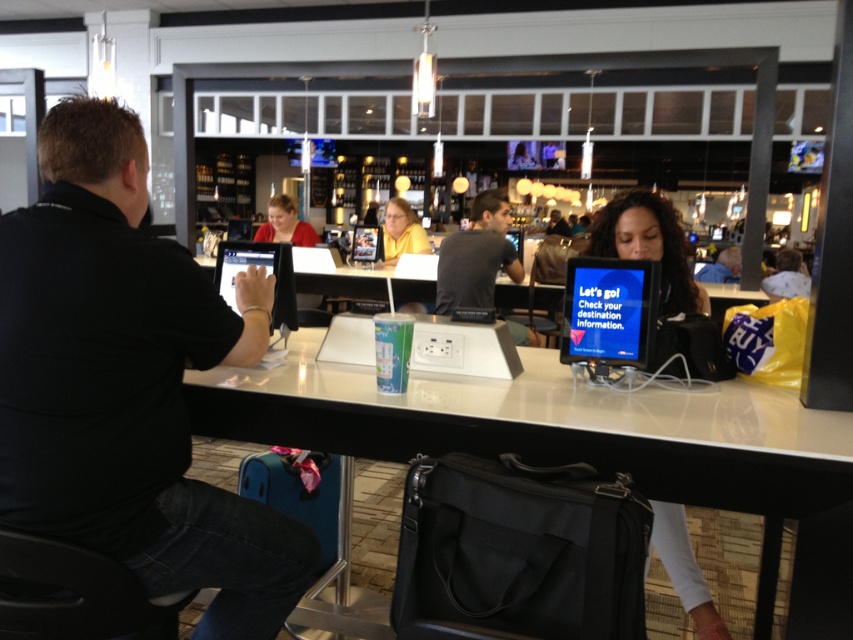
Can you confirm if matte red shirt at center is positioned below matte black shirt at center?

Indeed, matte red shirt at center is positioned under matte black shirt at center.

Can you confirm if matte red shirt at center is thinner than matte black shirt at center?

Yes.

Locate an element on the screen. Image resolution: width=853 pixels, height=640 pixels. matte red shirt at center is located at coordinates (285, 224).

Based on the photo, can you confirm if black matte laptop at left is positioned to the right of matte black laptop at center?

No, black matte laptop at left is not to the right of matte black laptop at center.

Can you confirm if black matte laptop at left is smaller than matte black laptop at center?

Yes.

Is point (49, 445) behind point (730, 266)?

That is False.

The image size is (853, 640). What are the coordinates of `black matte laptop at left` in the screenshot? It's located at (128, 384).

Measure the distance from blue glossy monitor at center to yellow matte shirt at center.

A distance of 3.54 meters exists between blue glossy monitor at center and yellow matte shirt at center.

Is point (590, 348) positioned in front of point (392, 241)?

Yes, point (590, 348) is closer to viewer.

Locate an element on the screen. Image resolution: width=853 pixels, height=640 pixels. blue glossy monitor at center is located at coordinates (608, 310).